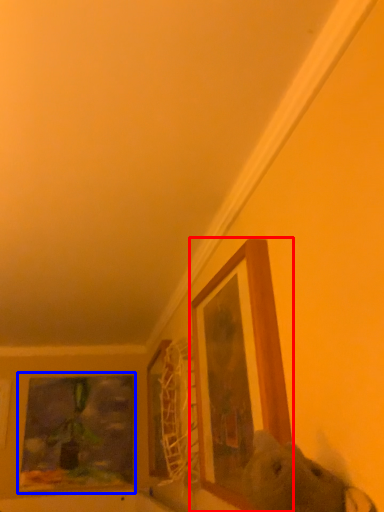
Question: Which of the following is the closest to the observer, picture frame (highlighted by a red box) or picture frame (highlighted by a blue box)?

Choices:
 (A) picture frame
 (B) picture frame

Answer: (A)